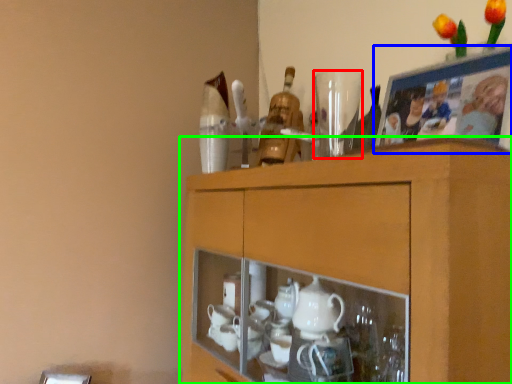
Question: Considering the real-world distances, which object is farthest from tableware (highlighted by a red box)? picture frame (highlighted by a blue box) or cabinetry (highlighted by a green box)?

Choices:
 (A) picture frame
 (B) cabinetry

Answer: (B)